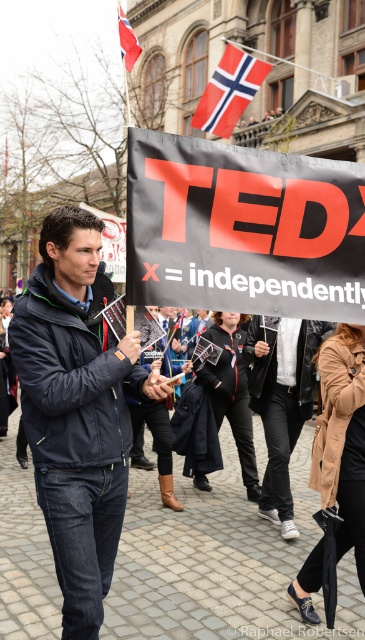
Who is higher up, black fabric banner at center or dark blue jacket at center?

Positioned higher is black fabric banner at center.

Is point (151, 301) positioned behind point (59, 291)?

No, it is in front of (59, 291).

Where is `black fabric banner at center`? black fabric banner at center is located at coordinates (243, 228).

What do you see at coordinates (243, 228) in the screenshot?
I see `black fabric banner at center` at bounding box center [243, 228].

Is point (359, 193) positioned before point (254, 83)?

Yes, point (359, 193) is in front of point (254, 83).

Locate an element on the screen. The image size is (365, 640). black fabric banner at center is located at coordinates (243, 228).

Can you confirm if dark blue jacket at center is positioned above red and white striped flag at upper center?

No, dark blue jacket at center is not above red and white striped flag at upper center.

Who is positioned more to the right, dark blue jacket at center or red and white striped flag at upper center?

red and white striped flag at upper center

Describe the element at coordinates (78, 410) in the screenshot. I see `dark blue jacket at center` at that location.

At what (x,y) coordinates should I click in order to perform the action: click on dark blue jacket at center. Please return your answer as a coordinate pair (x, y). Looking at the image, I should click on (78, 410).